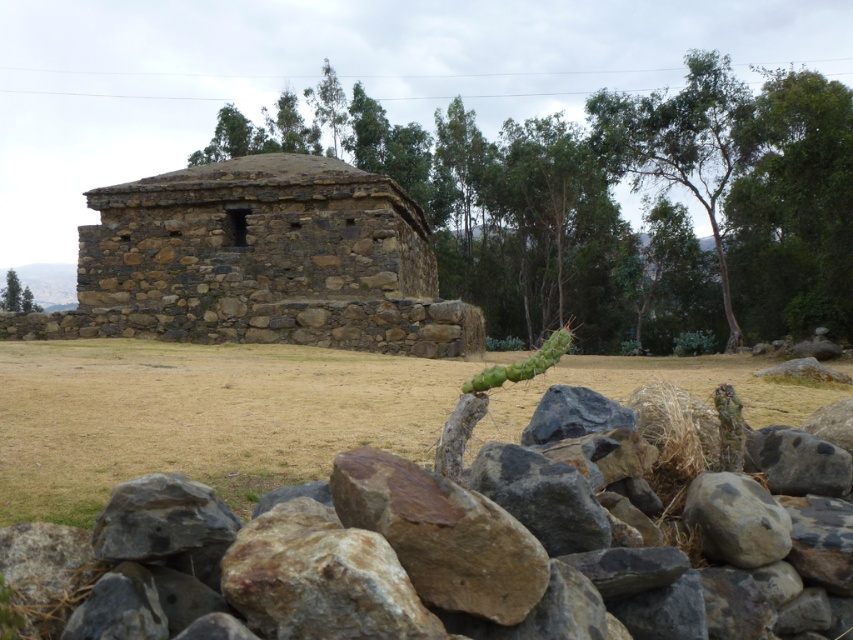
Is point (630, 250) behind point (21, 300)?

No, (630, 250) is in front of (21, 300).

Does brown stone building at center have a lesser height compared to green leafy tree at upper left?

Incorrect, brown stone building at center's height does not fall short of green leafy tree at upper left's.

Which is in front, point (740, 90) or point (10, 275)?

Positioned in front is point (740, 90).

Identify the location of brown stone building at center. (645, 211).

At what (x,y) coordinates should I click in order to perform the action: click on green grass at center. Please return your answer as a coordinate pair (x, y). This screenshot has width=853, height=640. Looking at the image, I should click on (202, 417).

Can you confirm if green grass at center is bigger than green leafy tree at upper left?

No, green grass at center is not bigger than green leafy tree at upper left.

This screenshot has width=853, height=640. Find the location of `green grass at center`. green grass at center is located at coordinates (202, 417).

The width and height of the screenshot is (853, 640). I want to click on green grass at center, so [202, 417].

Can you confirm if brown stone building at center is positioned below brown stone hut at center?

Actually, brown stone building at center is above brown stone hut at center.

The width and height of the screenshot is (853, 640). What do you see at coordinates (645, 211) in the screenshot? I see `brown stone building at center` at bounding box center [645, 211].

What do you see at coordinates (645, 211) in the screenshot?
I see `brown stone building at center` at bounding box center [645, 211].

You are a GUI agent. You are given a task and a screenshot of the screen. Output one action in this format:
    pyautogui.click(x=<x>, y=<y>)
    Task: Click on the brown stone building at center
    The height and width of the screenshot is (640, 853).
    Given the screenshot: What is the action you would take?
    pyautogui.click(x=645, y=211)